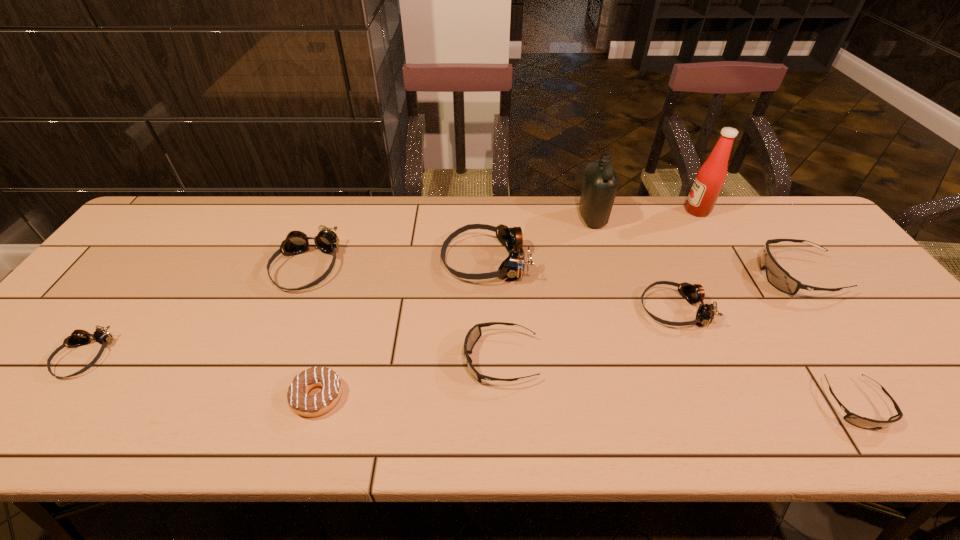
Where is `free spot located through the lenses of the tallest goggles`? Image resolution: width=960 pixels, height=540 pixels. free spot located through the lenses of the tallest goggles is located at coordinates (346, 261).

You are a GUI agent. You are given a task and a screenshot of the screen. Output one action in this format:
    pyautogui.click(x=<x>, y=<y>)
    Task: Click on the free space located 0.130m through the lenses of the tallest goggles
    
    Given the screenshot: What is the action you would take?
    pyautogui.click(x=396, y=261)

Identify the location of free space located through the lenses of the tallest goggles. The height and width of the screenshot is (540, 960). (300, 261).

The image size is (960, 540). I want to click on vacant point located through the lenses of the second bronze goggles from left to right, so click(249, 410).

The width and height of the screenshot is (960, 540). In order to click on vacant point located 0.110m on the lenses of the biggest black goggles in this screenshot , I will do `click(719, 276)`.

Where is `vacant space situated on the lenses of the biggest black goggles`? vacant space situated on the lenses of the biggest black goggles is located at coordinates (621, 276).

The height and width of the screenshot is (540, 960). Identify the location of free spot located on the lenses of the biggest black goggles. (727, 276).

I want to click on free space located through the lenses of the rightmost bronze goggles, so click(x=527, y=309).

Where is `vacant area located 0.270m through the lenses of the rightmost bronze goggles`? The image size is (960, 540). vacant area located 0.270m through the lenses of the rightmost bronze goggles is located at coordinates (535, 309).

Where is `vacant region located 0.190m through the lenses of the rightmost bronze goggles`? vacant region located 0.190m through the lenses of the rightmost bronze goggles is located at coordinates (566, 309).